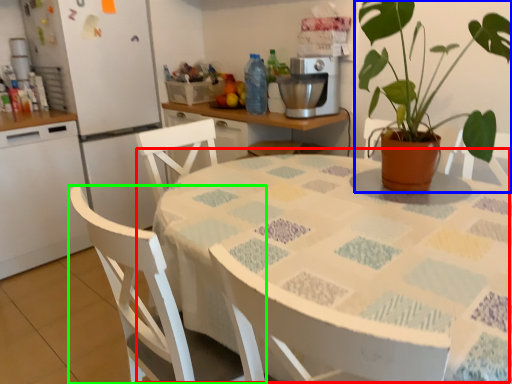
Question: Which object is positioned closest to table (highlighted by a red box)? Select from houseplant (highlighted by a blue box) and chair (highlighted by a green box).

Choices:
 (A) houseplant
 (B) chair

Answer: (B)